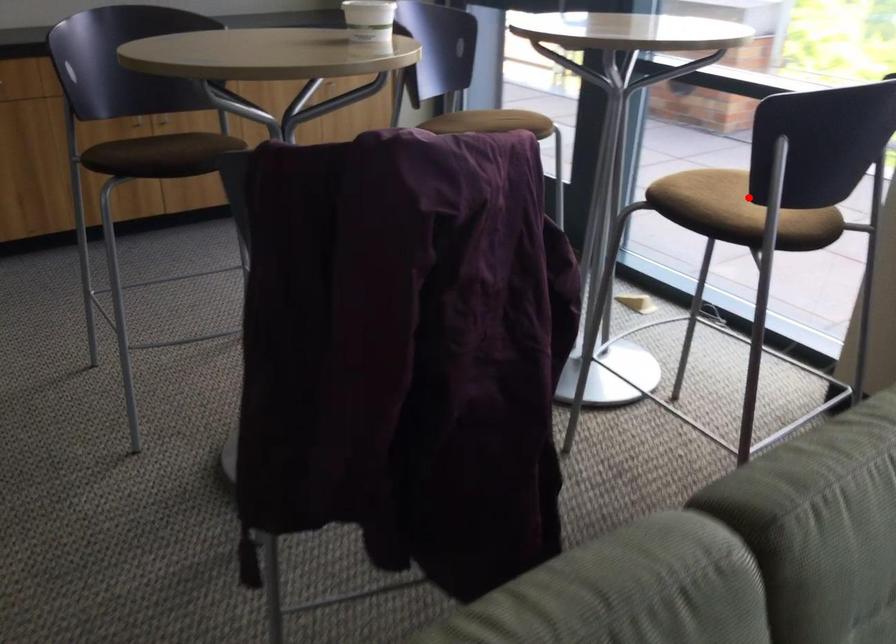
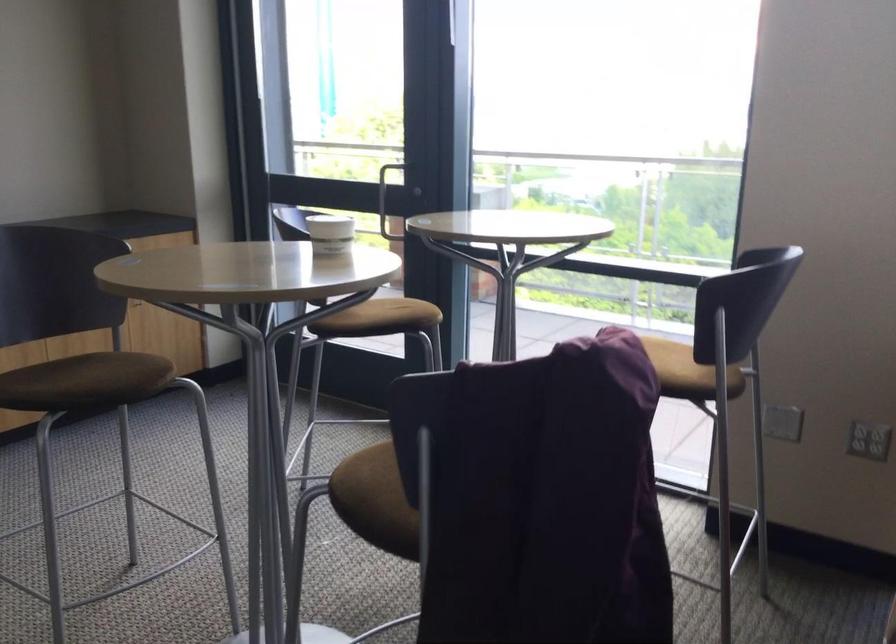
Question: I am providing you with two images of the same scene from different viewpoints. A red point is shown in image1. For the corresponding object point in image2, is it positioned nearer or farther from the camera?

Choices:
 (A) Nearer
 (B) Farther

Answer: (B)